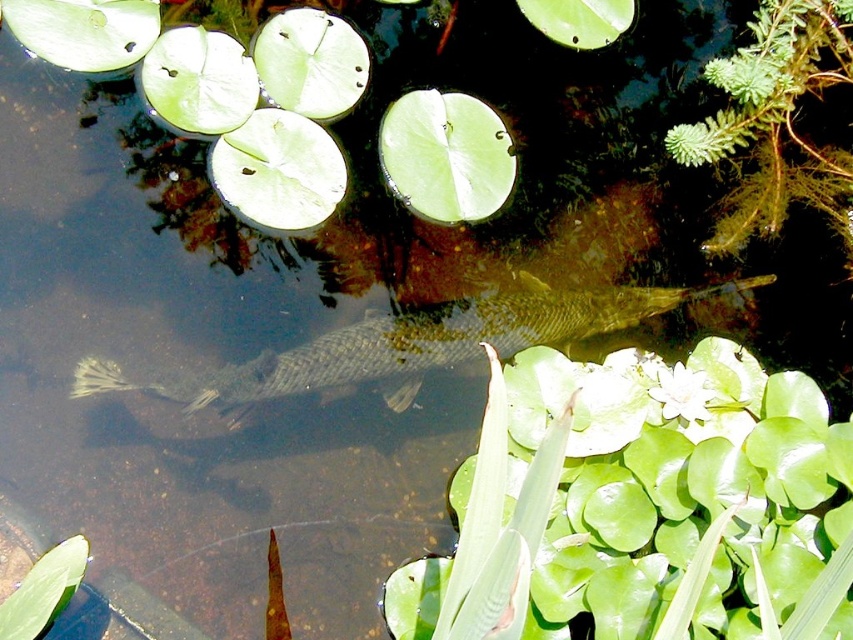
Is shiny silver fish at center above green fuzzy plant at upper right?

No.

How distant is shiny silver fish at center from green fuzzy plant at upper right?

shiny silver fish at center is 14.63 inches from green fuzzy plant at upper right.

Is point (235, 388) positioned after point (798, 20)?

That is True.

You are a GUI agent. You are given a task and a screenshot of the screen. Output one action in this format:
    pyautogui.click(x=<x>, y=<y>)
    Task: Click on the shiny silver fish at center
    This screenshot has height=640, width=853.
    Given the screenshot: What is the action you would take?
    pos(410,344)

Can you confirm if green glossy leaf at center is positioned above shiny silver fish at center?

Incorrect, green glossy leaf at center is not positioned above shiny silver fish at center.

Does point (804, 392) come closer to viewer compared to point (274, 376)?

Yes, it is in front of point (274, 376).

Identify the location of green glossy leaf at center. (639, 509).

Can you confirm if green fuzzy plant at upper right is positioned below green leafy plant at lower left?

No.

Is green fuzzy plant at upper right shorter than green leafy plant at lower left?

In fact, green fuzzy plant at upper right may be taller than green leafy plant at lower left.

Describe the element at coordinates (775, 120) in the screenshot. I see `green fuzzy plant at upper right` at that location.

At what (x,y) coordinates should I click in order to perform the action: click on green fuzzy plant at upper right. Please return your answer as a coordinate pair (x, y). The height and width of the screenshot is (640, 853). Looking at the image, I should click on (775, 120).